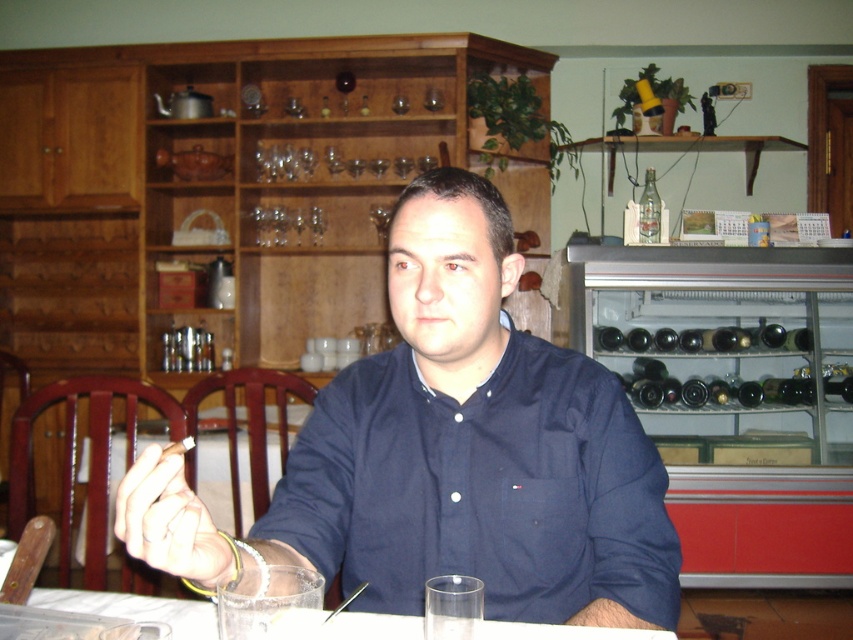
You are a delivery person standing at the entrance of the restaurant. You need to place a package that is 35 inches long on the clear glassware at center. Can you fit it there?

The clear glassware at center is 34.21 inches from viewer. The package is 35 inches long, which is slightly longer than the distance available. Therefore, the package cannot be placed on the clear glassware at center as it would not fit.

You are a waiter in a restaurant and need to place a new drink order on the table. There is a point marked at coordinates (x=215, y=477) on the table. What object is located at that point?

The point at coordinates (x=215, y=477) is on a clear plastic glass at lower center.